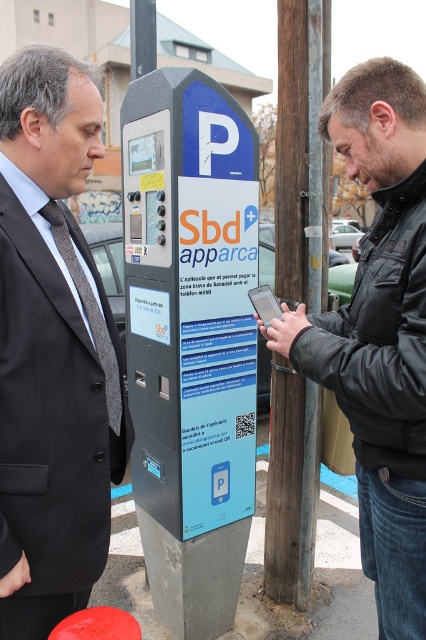
Question: Is black leather jacket at center further to camera compared to matte black phone at center?

Choices:
 (A) no
 (B) yes

Answer: (A)

Question: Observing the image, what is the correct spatial positioning of rubber red stool at lower left in reference to matte black phone at center?

Choices:
 (A) above
 (B) below

Answer: (B)

Question: Which of the following is the farthest from the observer?

Choices:
 (A) (109, 632)
 (B) (419, 560)

Answer: (B)

Question: Does dark gray suit at left appear over rubber red stool at lower left?

Choices:
 (A) no
 (B) yes

Answer: (B)

Question: Estimate the real-world distances between objects in this image. Which object is farther from the wooden post at center?

Choices:
 (A) black leather jacket at center
 (B) dark gray suit at left

Answer: (B)

Question: Among these points, which one is nearest to the camera?

Choices:
 (A) (83, 616)
 (B) (268, 321)
 (C) (319, 97)
 (D) (268, 337)

Answer: (A)